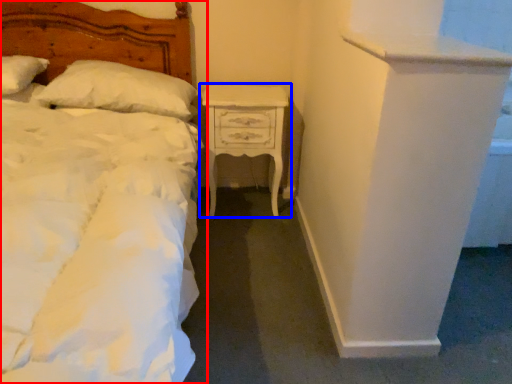
Question: Which of the following is the farthest to the observer, bed (highlighted by a red box) or nightstand (highlighted by a blue box)?

Choices:
 (A) bed
 (B) nightstand

Answer: (B)